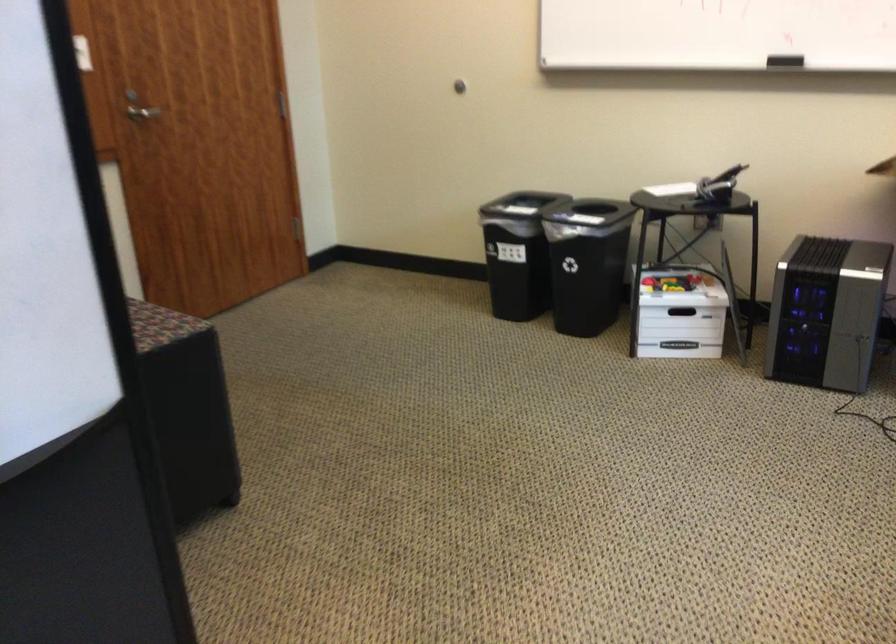
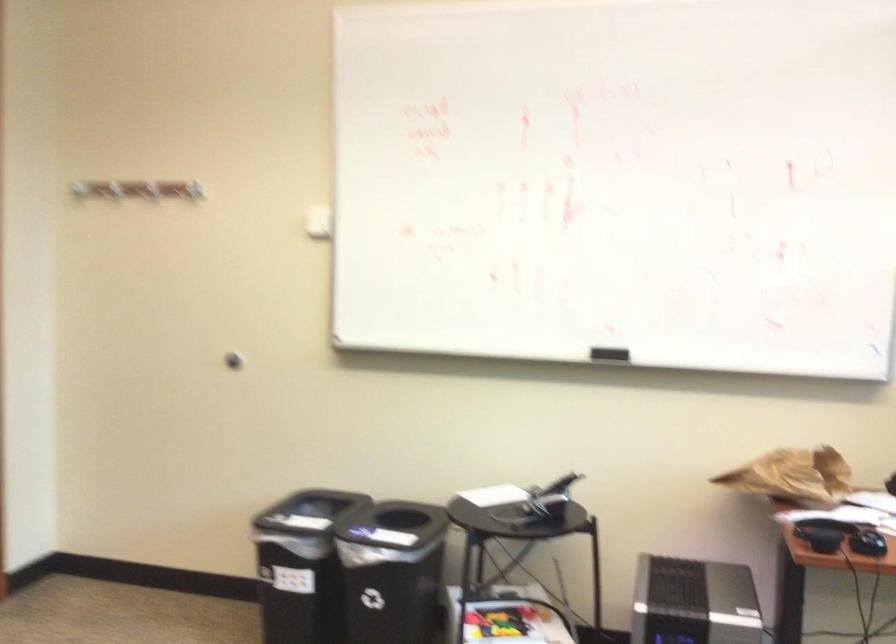
How did the camera likely rotate?

The camera's rotation is toward right-up.